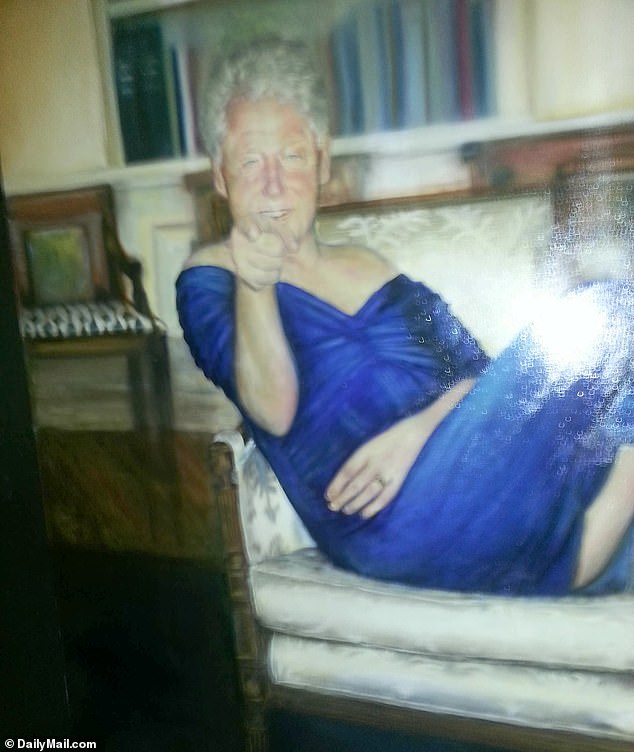
Find the location of a particular element. The width and height of the screenshot is (634, 752). floor is located at coordinates (158, 607).